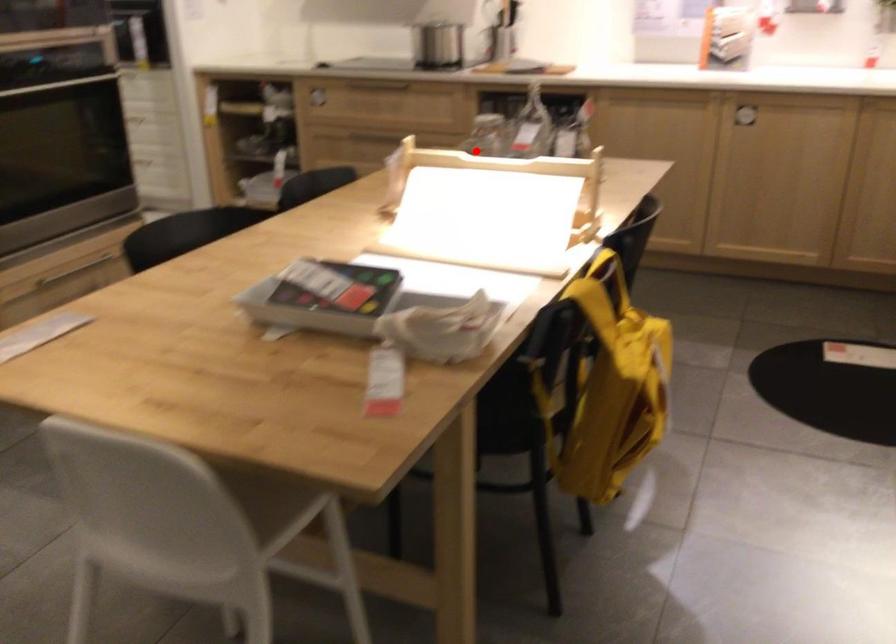
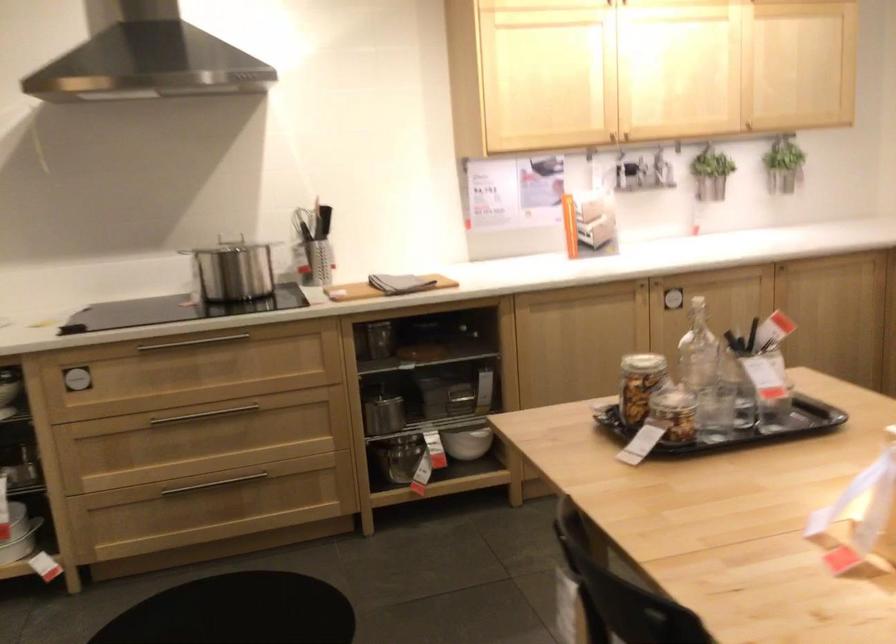
Find the pixel in the second image that matches the highlighted location in the first image.

(673, 413)